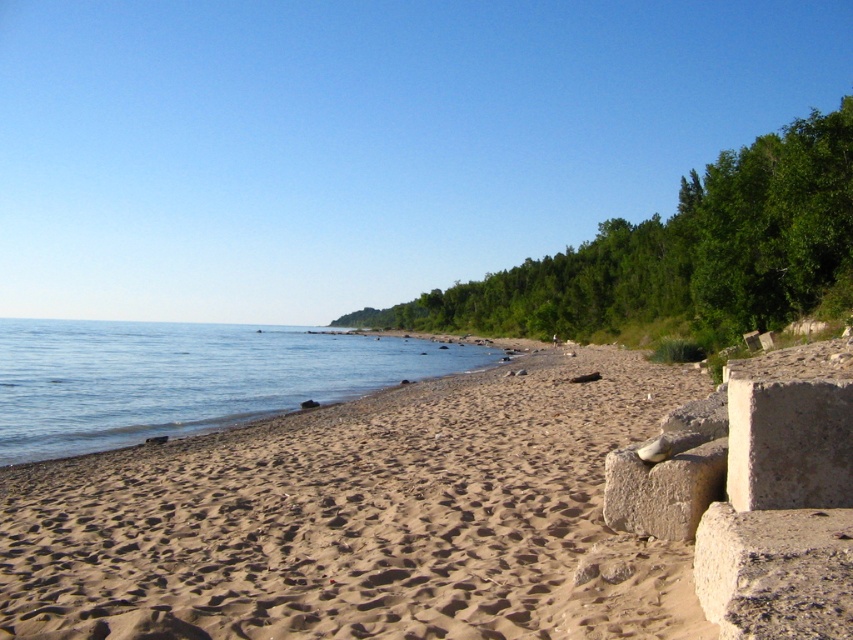
Is fine-grained sand at lower left above gray rough concrete at lower right?

Actually, fine-grained sand at lower left is below gray rough concrete at lower right.

Is point (277, 554) positioned behind point (785, 536)?

Yes, point (277, 554) is farther from viewer.

Who is more distant from viewer, (529, 515) or (798, 557)?

Point (529, 515)

The height and width of the screenshot is (640, 853). What are the coordinates of `fine-grained sand at lower left` in the screenshot? It's located at (360, 518).

Does clear water at lower left appear over gray rough concrete at lower right?

Incorrect, clear water at lower left is not positioned above gray rough concrete at lower right.

Can you confirm if clear water at lower left is smaller than gray rough concrete at lower right?

Actually, clear water at lower left might be larger than gray rough concrete at lower right.

Who is more forward, (24, 429) or (782, 531)?

Positioned in front is point (782, 531).

Locate an element on the screen. The image size is (853, 640). clear water at lower left is located at coordinates (186, 378).

Is fine-grained sand at lower left thinner than clear water at lower left?

Correct, fine-grained sand at lower left's width is less than clear water at lower left's.

Who is positioned more to the right, fine-grained sand at lower left or clear water at lower left?

Positioned to the right is fine-grained sand at lower left.

Locate an element on the screen. Image resolution: width=853 pixels, height=640 pixels. fine-grained sand at lower left is located at coordinates (360, 518).

Where is `fine-grained sand at lower left`? Image resolution: width=853 pixels, height=640 pixels. fine-grained sand at lower left is located at coordinates (360, 518).